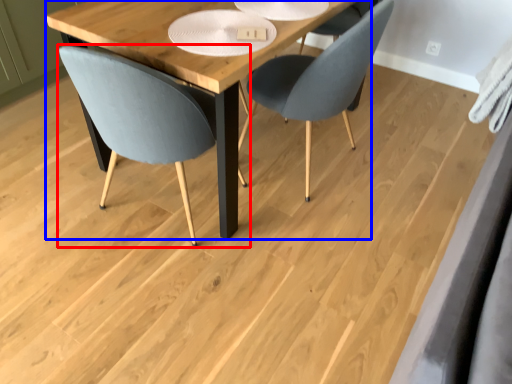
Question: Which object is closer to the camera taking this photo, chair (highlighted by a red box) or table (highlighted by a blue box)?

Choices:
 (A) chair
 (B) table

Answer: (A)